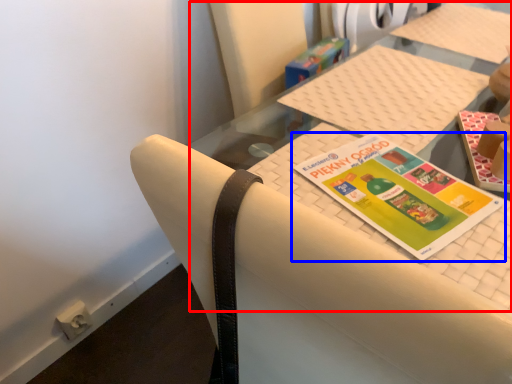
Question: Which object is further to the camera taking this photo, tablecloth (highlighted by a red box) or book (highlighted by a blue box)?

Choices:
 (A) tablecloth
 (B) book

Answer: (B)